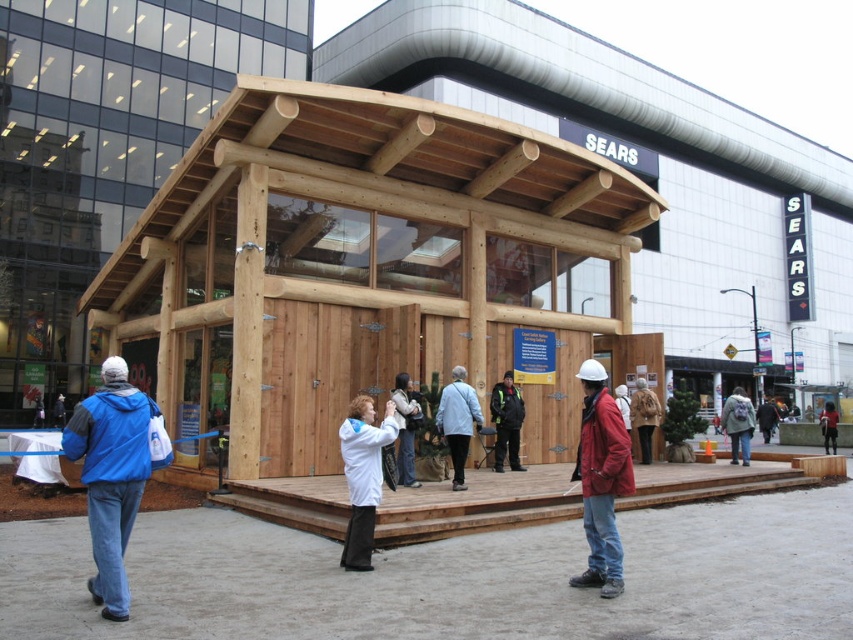
Question: Which of the following is the closest to the observer?

Choices:
 (A) light blue fabric coat at center
 (B) dark blue jacket at center

Answer: (A)

Question: Considering the real-world distances, which object is closest to the green fuzzy coat at center?

Choices:
 (A) matte red jacket at center
 (B) black leather jacket at center
 (C) light blue fabric coat at center
 (D) blue fabric jacket at lower left

Answer: (B)

Question: Is green fuzzy coat at center wider than dark blue jacket at center?

Choices:
 (A) no
 (B) yes

Answer: (B)

Question: Can you confirm if green fuzzy coat at center is smaller than dark blue jacket at center?

Choices:
 (A) yes
 (B) no

Answer: (B)

Question: Considering the relative positions of blue fabric jacket at lower left and light brown leather jacket at center in the image provided, where is blue fabric jacket at lower left located with respect to light brown leather jacket at center?

Choices:
 (A) left
 (B) right

Answer: (A)

Question: Considering the real-world distances, which object is closest to the black leather jacket at center?

Choices:
 (A) green fuzzy coat at center
 (B) light brown leather jacket at center
 (C) natural wood cabin at center

Answer: (B)